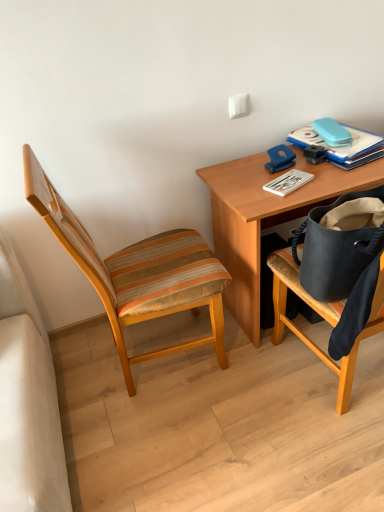
You are a GUI agent. You are given a task and a screenshot of the screen. Output one action in this format:
    pyautogui.click(x=<x>, y=<y>)
    Task: Click on the free space in front of white matte paperback book at upper right, which is the 2th paperback book from top to bottom
    The image size is (384, 512).
    Given the screenshot: What is the action you would take?
    pyautogui.click(x=296, y=193)